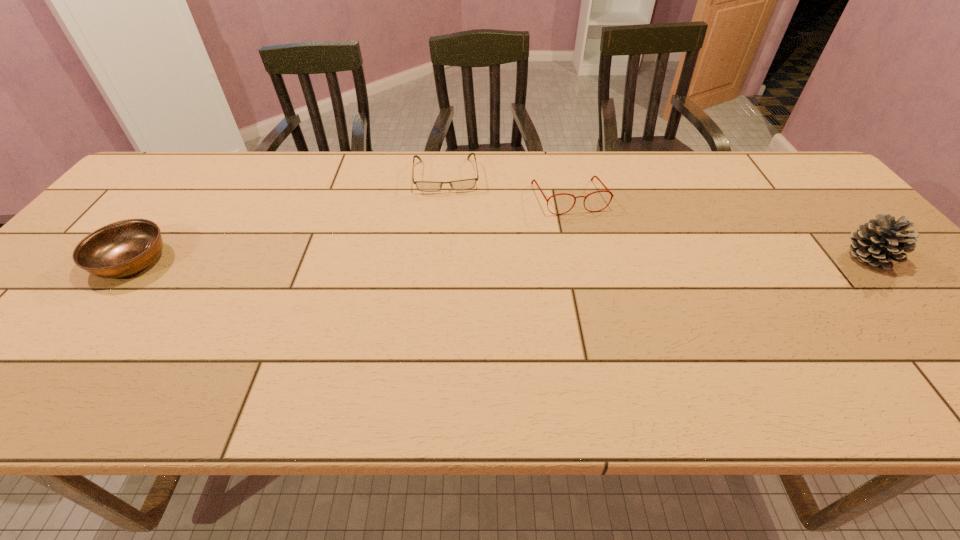
I want to click on the leftmost object, so click(122, 248).

At what (x,y) coordinates should I click in order to perform the action: click on soup bowl. Please return your answer as a coordinate pair (x, y). The image size is (960, 540). Looking at the image, I should click on (122, 248).

Identify the location of the rightmost object. (877, 242).

The width and height of the screenshot is (960, 540). What are the coordinates of `the tallest object` in the screenshot? It's located at (877, 242).

Where is `the shorter spectacles`? the shorter spectacles is located at coordinates (427, 186).

Locate an element on the screen. This screenshot has height=540, width=960. the left spectacles is located at coordinates (427, 186).

At what (x,y) coordinates should I click in order to perform the action: click on the third object from left to right. Please return your answer as a coordinate pair (x, y). The image size is (960, 540). Looking at the image, I should click on (592, 178).

The height and width of the screenshot is (540, 960). I want to click on the right spectacles, so click(x=592, y=178).

This screenshot has height=540, width=960. Find the location of `free space located 0.400m on the back of the third tallest object`. free space located 0.400m on the back of the third tallest object is located at coordinates (214, 156).

You are a GUI agent. You are given a task and a screenshot of the screen. Output one action in this format:
    pyautogui.click(x=<x>, y=<y>)
    Task: Click on the vacant space positioned 0.300m on the left of the rightmost object
    This screenshot has width=960, height=540.
    Given the screenshot: What is the action you would take?
    pyautogui.click(x=723, y=257)